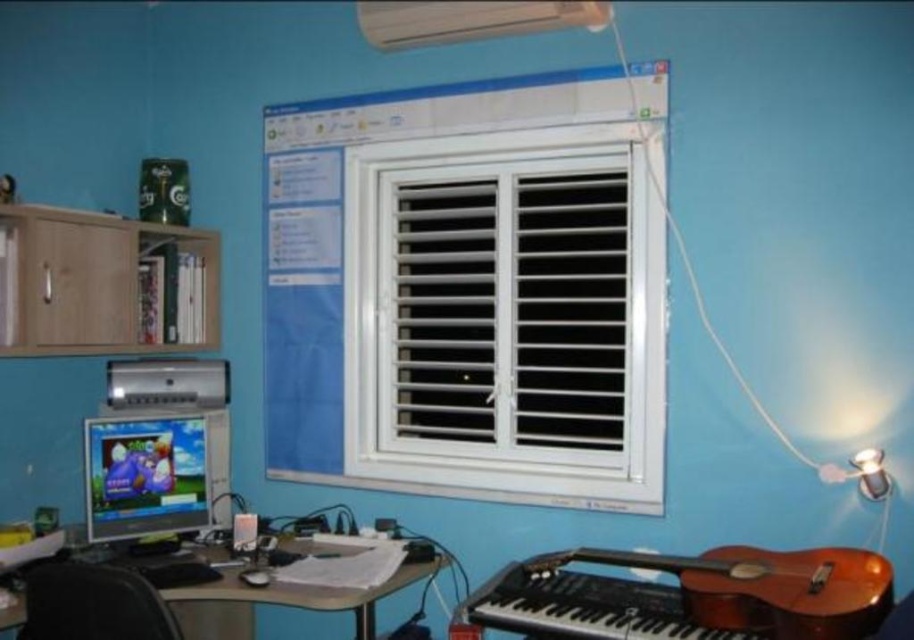
Question: Is white plastic window at center to the right of matte black monitor at lower left from the viewer's perspective?

Choices:
 (A) no
 (B) yes

Answer: (B)

Question: Observing the image, what is the correct spatial positioning of black plastic keyboard at lower center in reference to black leather chair at lower left?

Choices:
 (A) below
 (B) above

Answer: (A)

Question: Among these points, which one is nearest to the camera?

Choices:
 (A) (406, 285)
 (B) (112, 592)

Answer: (B)

Question: Observing the image, what is the correct spatial positioning of white plastic window at center in reference to matte black desk at center?

Choices:
 (A) below
 (B) above

Answer: (B)

Question: Which of these objects is positioned closest to the matte black desk at center?

Choices:
 (A) black plastic keyboard at lower center
 (B) matte black monitor at lower left

Answer: (B)

Question: Which point is farther from the camera taking this photo?

Choices:
 (A) (838, 547)
 (B) (84, 566)
 (C) (183, 467)
 (D) (484, 234)

Answer: (D)